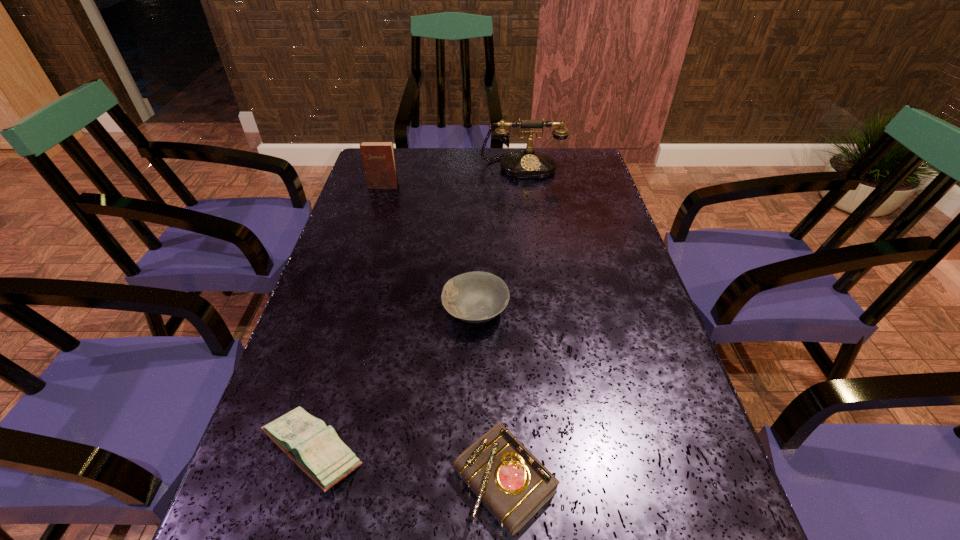
The image size is (960, 540). In order to click on the farthest object in this screenshot , I will do `click(529, 164)`.

Identify the location of telephone. Image resolution: width=960 pixels, height=540 pixels. (529, 164).

Where is `the farthest diary`? the farthest diary is located at coordinates (378, 157).

Image resolution: width=960 pixels, height=540 pixels. I want to click on the fourth nearest object, so click(378, 157).

Identify the location of the third nearest object. Image resolution: width=960 pixels, height=540 pixels. (475, 297).

I want to click on blank area located 0.140m on the dial of the telephone, so click(x=527, y=205).

The image size is (960, 540). I want to click on vacant space located on the front cover of the farthest diary, so (x=368, y=236).

The image size is (960, 540). In order to click on vacant region located on the left of the third nearest object in this screenshot , I will do [390, 311].

Locate an element on the screen. The height and width of the screenshot is (540, 960). object that is at the far edge is located at coordinates (529, 164).

The image size is (960, 540). Find the location of `object that is at the right edge`. object that is at the right edge is located at coordinates coord(529,164).